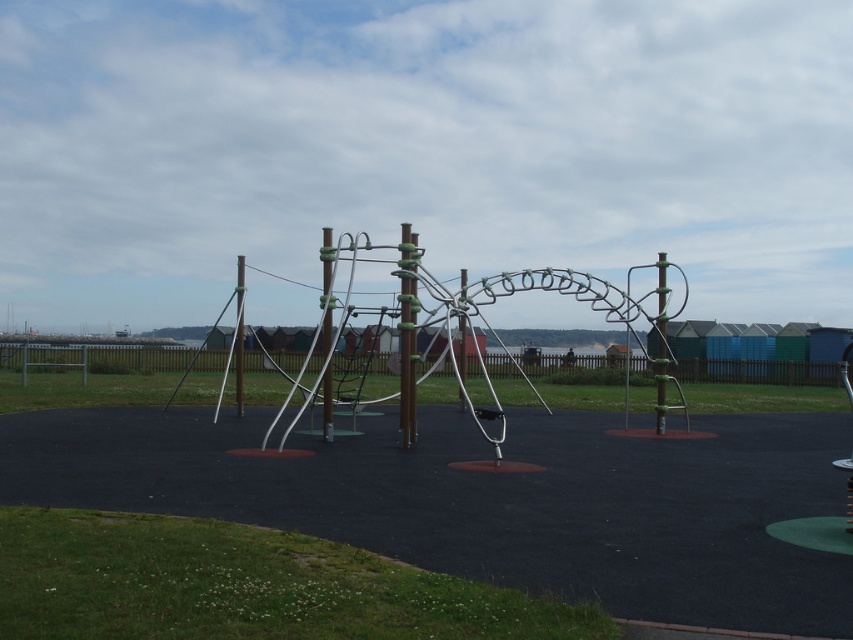
Can you confirm if green rubber pole at center is thinner than green plastic pole at center?

Yes.

At what (x,y) coordinates should I click in order to perform the action: click on green rubber pole at center. Please return your answer as a coordinate pair (x, y). Looking at the image, I should click on (328, 330).

This screenshot has width=853, height=640. What are the coordinates of `green rubber pole at center` in the screenshot? It's located at (328, 330).

Between green matte pole at center and green rubber pole at center, which one appears on the left side from the viewer's perspective?

Positioned to the left is green rubber pole at center.

Who is lower down, green matte pole at center or green rubber pole at center?

green matte pole at center is below.

From the picture: Measure the distance between point [415,372] and camera.

A distance of 14.26 meters exists between point [415,372] and camera.

Where is `green matte pole at center`? The height and width of the screenshot is (640, 853). green matte pole at center is located at coordinates (407, 332).

Is metallic silver playground equipment at center bigger than metallic silver pole at right?

No, metallic silver playground equipment at center is not bigger than metallic silver pole at right.

Is point (204, 484) positioned behind point (662, 257)?

That is False.

Is point (576, 557) more distant than point (662, 380)?

No, (576, 557) is closer to viewer.

Where is `metallic silver playground equipment at center`? Image resolution: width=853 pixels, height=640 pixels. metallic silver playground equipment at center is located at coordinates (492, 500).